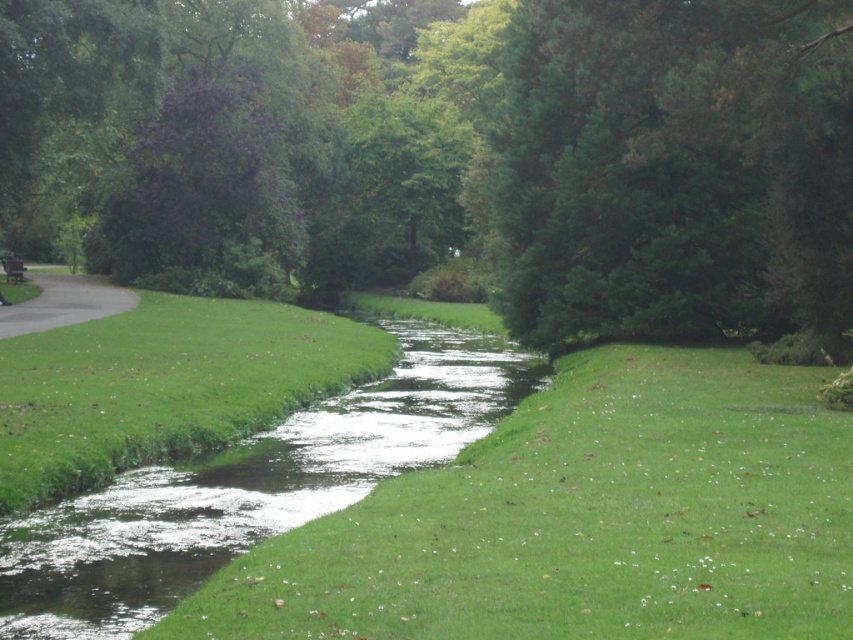
You are standing at the edge of the clear water stream at center and want to walk towards the green leafy tree at upper center. Which direction should you move in relation to the stream?

You should move to the left side of the clear water stream at center to reach the green leafy tree at upper center since it is located to the left of the stream.

You are standing at the point labeled as point (53, 307) and want to walk towards the point labeled as point (512, 595). Based on the scene description, will you be moving towards the background or the foreground of the image?

You will be moving towards the background of the image because point (512, 595) is in front of point (53, 307), meaning that point (53, 307) is located further back in the scene.